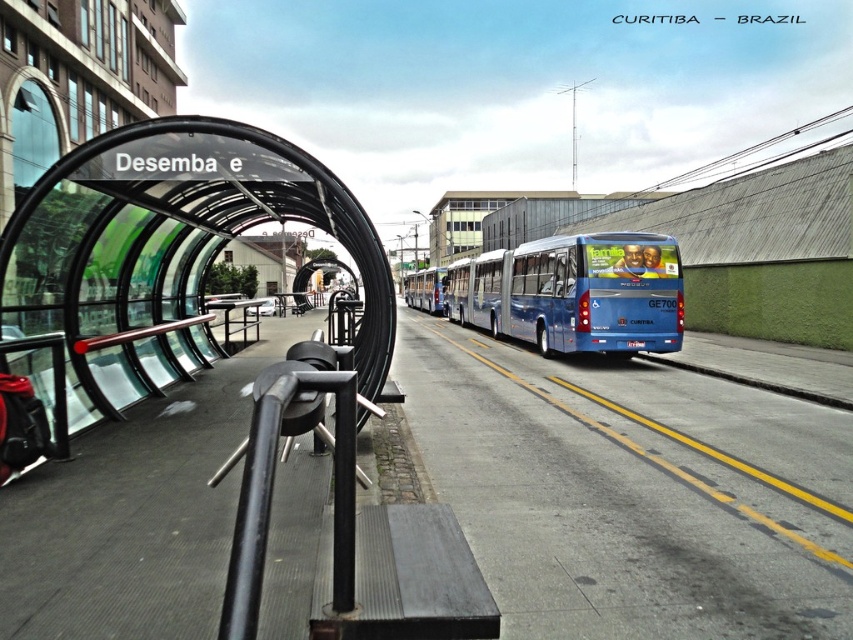
You are a pedestrian waiting at the bus stop and want to cross the street safely. The blue metallic bus at center is blocking your view of oncoming traffic. Can you see the traffic clearly from your position behind the gray concrete curb at lower right?

The blue metallic bus at center is positioned over the gray concrete curb at lower right, so it may block your view of oncoming traffic. You might need to move around the bus or wait until it moves to see clearly.

Based on the photo, you are a delivery person with a cart that is 1.5 meters wide. You need to move from the blue metallic bus at center to the gray concrete curb at lower right. Is there enough space between them for your cart to pass through?

The blue metallic bus at center is 11.19 meters away from the gray concrete curb at lower right. Since your cart is only 1.5 meters wide, there is sufficient space between them for your cart to pass through.